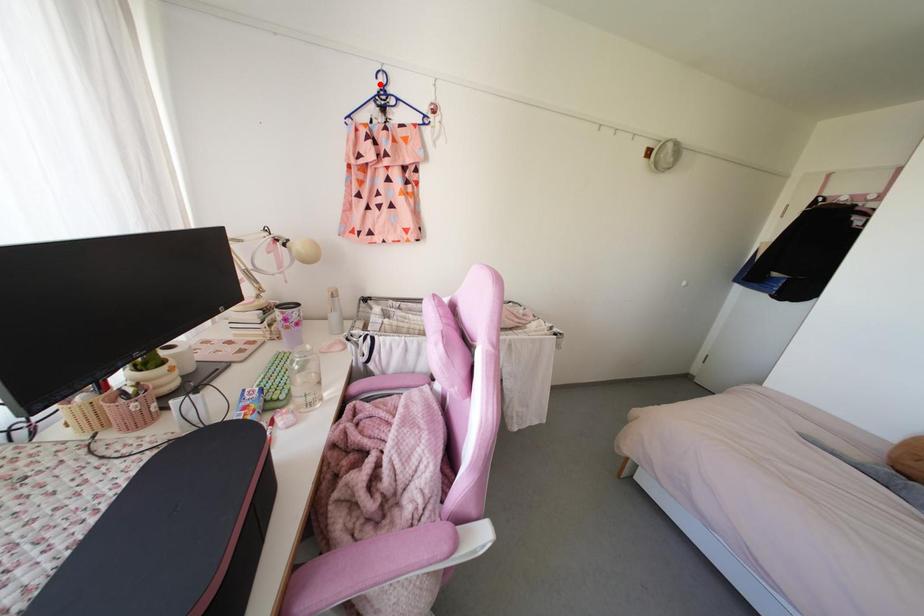
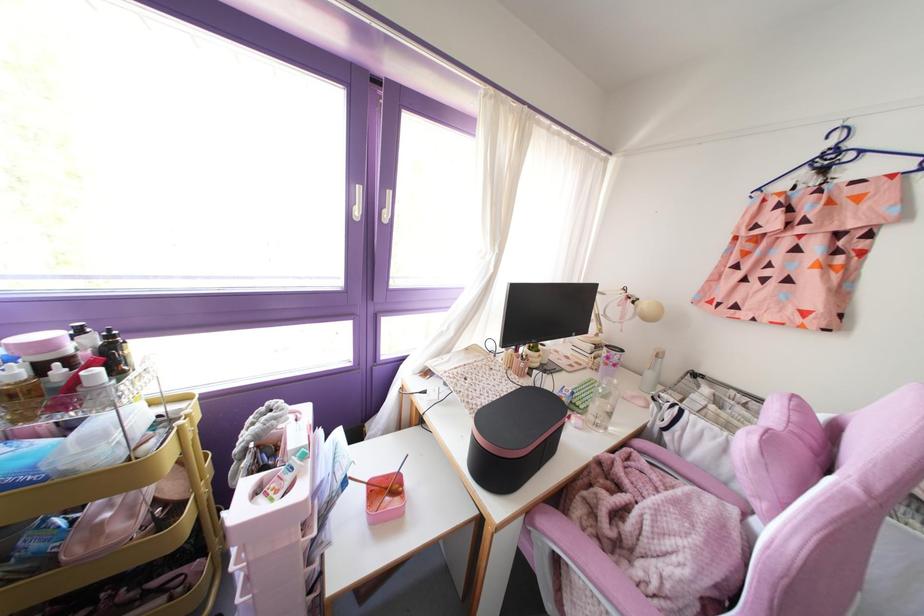
Question: I am providing you with two images of the same scene from different viewpoints. In image1, a red point is highlighted. Considering the same 3D point in image2, which of the following is correct?

Choices:
 (A) It is closer
 (B) It is farther

Answer: (B)